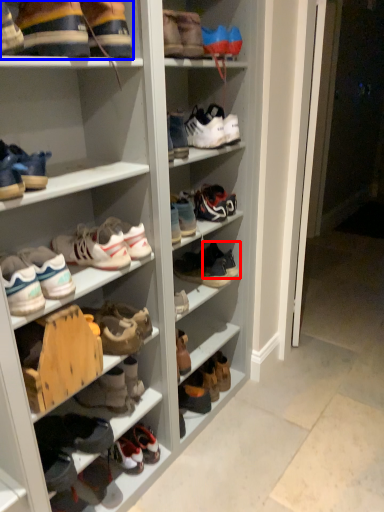
Question: Which point is further to the camera, footwear (highlighted by a red box) or footwear (highlighted by a blue box)?

Choices:
 (A) footwear
 (B) footwear

Answer: (A)